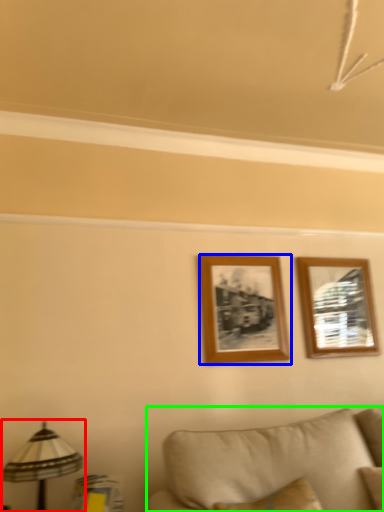
Question: Which object is positioned farthest from table lamp (highlighted by a red box)? Select from picture frame (highlighted by a blue box) and studio couch (highlighted by a green box).

Choices:
 (A) picture frame
 (B) studio couch

Answer: (A)